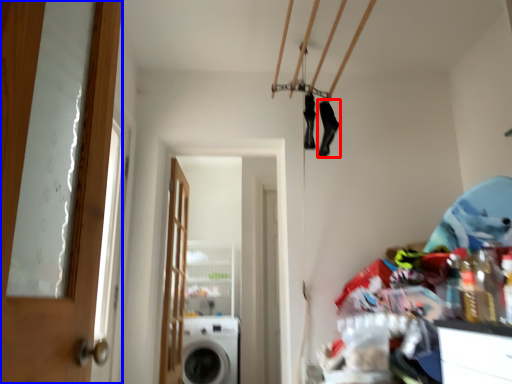
Question: Among these objects, which one is farthest to the camera, shoe (highlighted by a red box) or door (highlighted by a blue box)?

Choices:
 (A) shoe
 (B) door

Answer: (A)